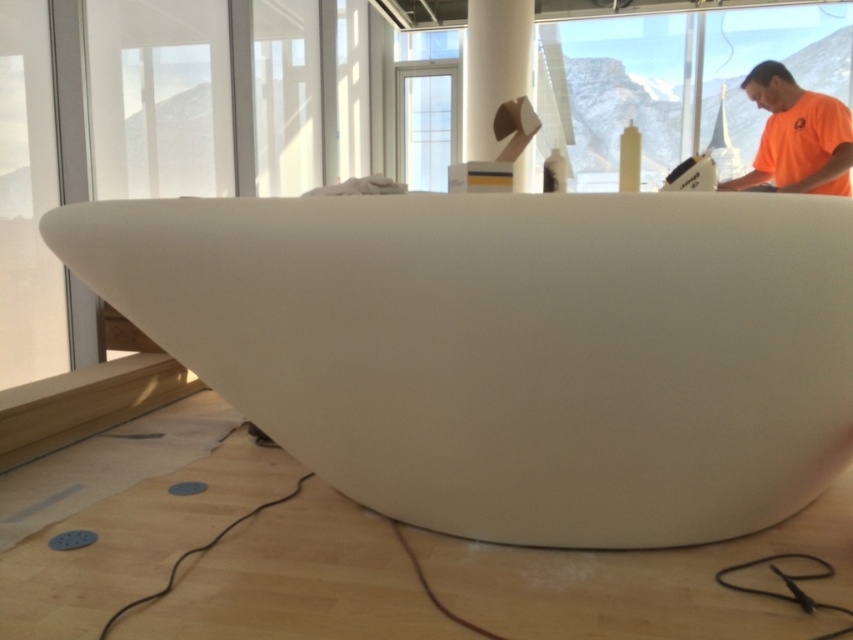
Question: Does orange t-shirt at upper right have a smaller size compared to matte white pillar at upper center?

Choices:
 (A) yes
 (B) no

Answer: (A)

Question: Can you confirm if matte white pillar at upper center is positioned to the left of clear glass window at center?

Choices:
 (A) no
 (B) yes

Answer: (A)

Question: Is the position of matte white pillar at upper center less distant than that of clear glass window at center?

Choices:
 (A) yes
 (B) no

Answer: (A)

Question: Which of the following is the farthest from the observer?

Choices:
 (A) white matte bathtub at center
 (B) matte white pillar at upper center
 (C) clear glass window at center
 (D) orange t-shirt at upper right

Answer: (C)

Question: Which point is closer to the camera taking this photo?

Choices:
 (A) (723, 182)
 (B) (369, 342)
 (C) (422, 186)
 (D) (479, 92)

Answer: (B)

Question: Which point is farther from the camera taking this photo?

Choices:
 (A) (764, 452)
 (B) (496, 141)
 (C) (807, 122)
 (D) (404, 160)

Answer: (D)